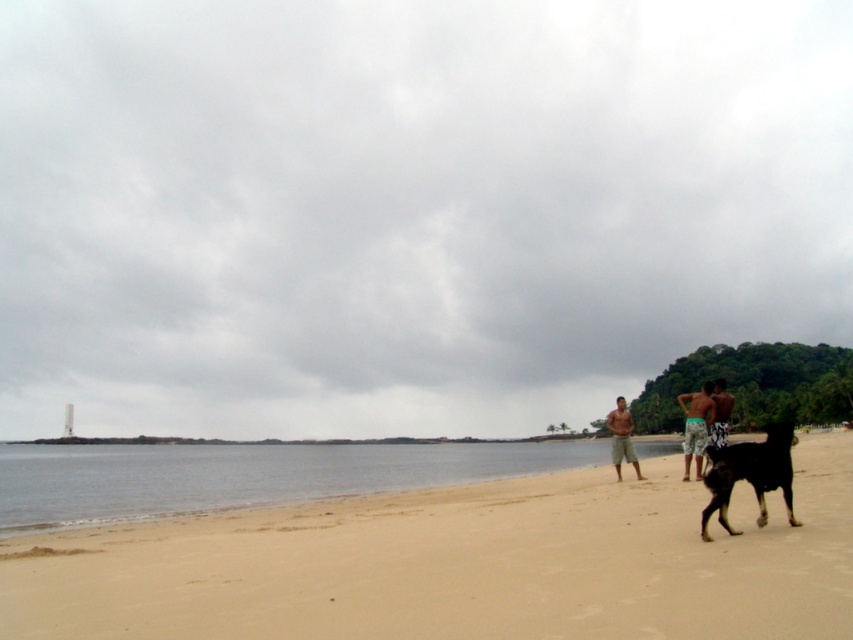
Looking at this image, does sandy beach at lower center have a larger size compared to clear water at lower left?

No, sandy beach at lower center is not bigger than clear water at lower left.

Who is positioned more to the right, sandy beach at lower center or clear water at lower left?

From the viewer's perspective, sandy beach at lower center appears more on the right side.

Between point (798, 476) and point (190, 458), which one is positioned in front?

Point (798, 476) is more forward.

This screenshot has width=853, height=640. Identify the location of sandy beach at lower center. click(x=460, y=564).

How far apart are clear water at lower left and black glossy dog at lower right?

clear water at lower left is 127.18 meters from black glossy dog at lower right.

Is clear water at lower left below black glossy dog at lower right?

Yes, clear water at lower left is below black glossy dog at lower right.

Image resolution: width=853 pixels, height=640 pixels. What are the coordinates of `clear water at lower left` in the screenshot? It's located at (245, 476).

Consider the image. Is sandy beach at lower center taller than camouflage shorts at right?

Indeed, sandy beach at lower center has a greater height compared to camouflage shorts at right.

Can you confirm if sandy beach at lower center is shorter than camouflage shorts at right?

In fact, sandy beach at lower center may be taller than camouflage shorts at right.

Is point (28, 545) behind point (698, 410)?

That is False.

Find the location of `sandy beach at lower center`. sandy beach at lower center is located at coordinates (460, 564).